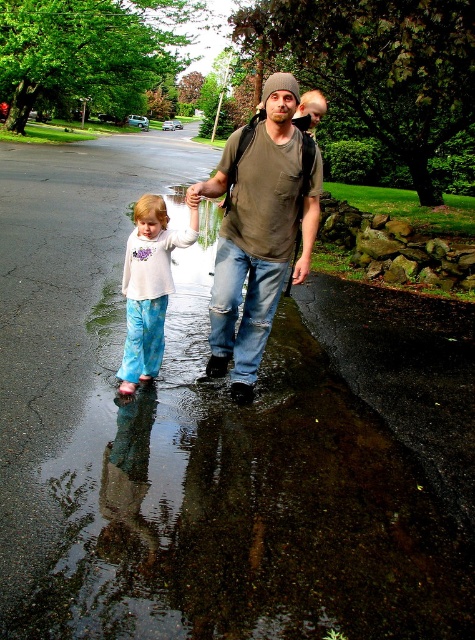
Where is `matte green t-shirt at center`? The height and width of the screenshot is (640, 475). matte green t-shirt at center is located at coordinates (258, 228).

Where is `matte green t-shirt at center`? This screenshot has height=640, width=475. matte green t-shirt at center is located at coordinates (258, 228).